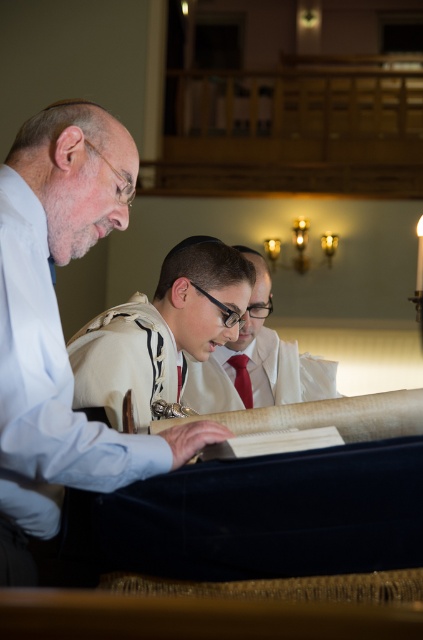
You are a photographer standing in the synagogue and want to capture a closeup shot of the matte white kippah at center. Given that your camera has a minimum focusing distance of 2 meters, will you be able to take the photo without moving closer?

The matte white kippah at center is 2.10 meters from the camera, which is just beyond the minimum focusing distance of 2 meters. Therefore, you can take the photo without moving closer as it is within range.

You are an interior designer planning to place a decorative item between the white fabric kippah at upper center and the matte white kippah at center. Which kippah should the item be closer to if you want it to be closer to the taller one?

The white fabric kippah at upper center is taller than the matte white kippah at center, so the decorative item should be placed closer to the white fabric kippah at upper center.